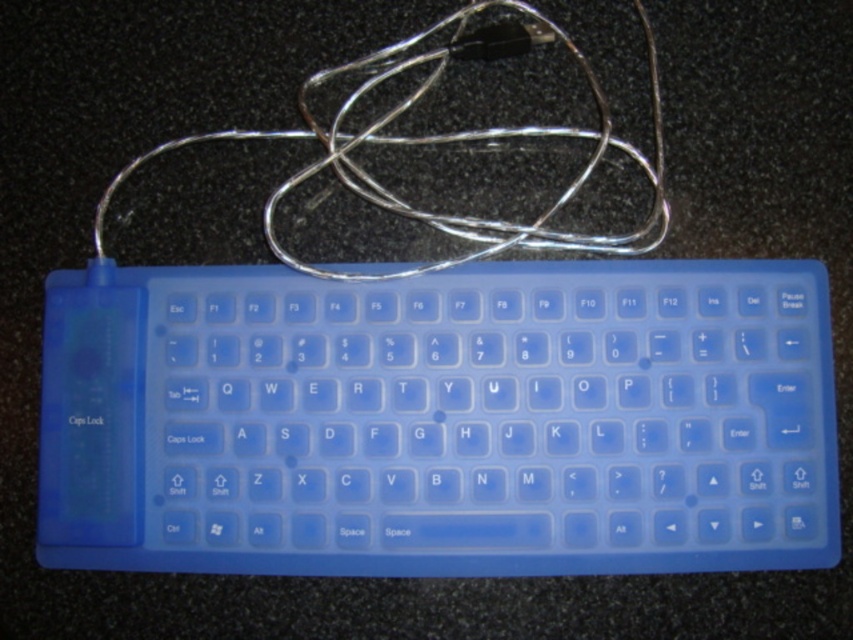
You are setting up a new wireless keyboard and need to connect it to your computer. You have a USB port on your computer that can only accommodate objects shorter than the keyboard itself. Based on the image, will the silver metallic wire at upper center fit into the USB port without exceeding the keyboard translucent blue keyboard at center in height?

The translucent blue keyboard at center is taller than the silver metallic wire at upper center, so the silver metallic wire at upper center will fit into the USB port since it is shorter in height than the keyboard.

From the picture: You are setting up a new wireless keyboard and notice the translucent blue keyboard at center and the silver metallic wire at upper center. According to the image, which object is positioned more to the left?

The silver metallic wire at upper center is positioned more to the left than the translucent blue keyboard at center.